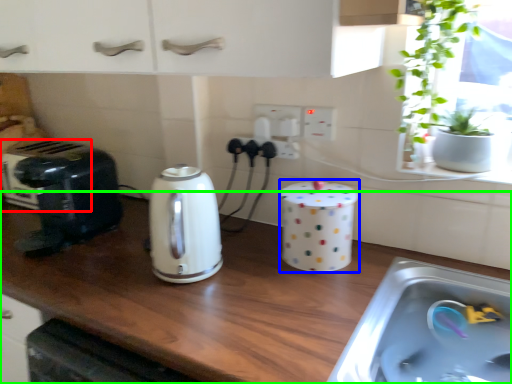
Question: Which object is positioned closest to appliance (highlighted by a red box)? Select from appliance (highlighted by a blue box) and countertop (highlighted by a green box).

Choices:
 (A) appliance
 (B) countertop

Answer: (B)